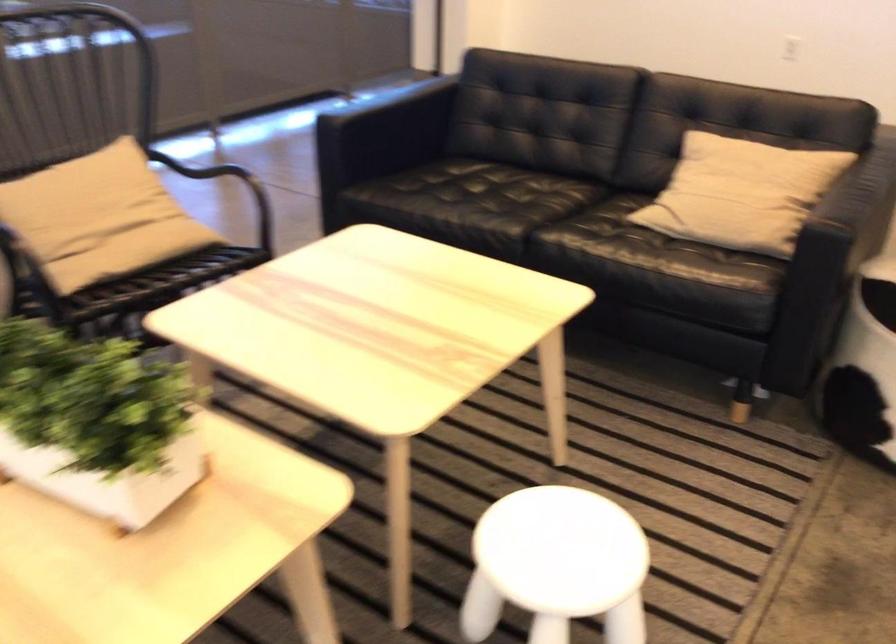
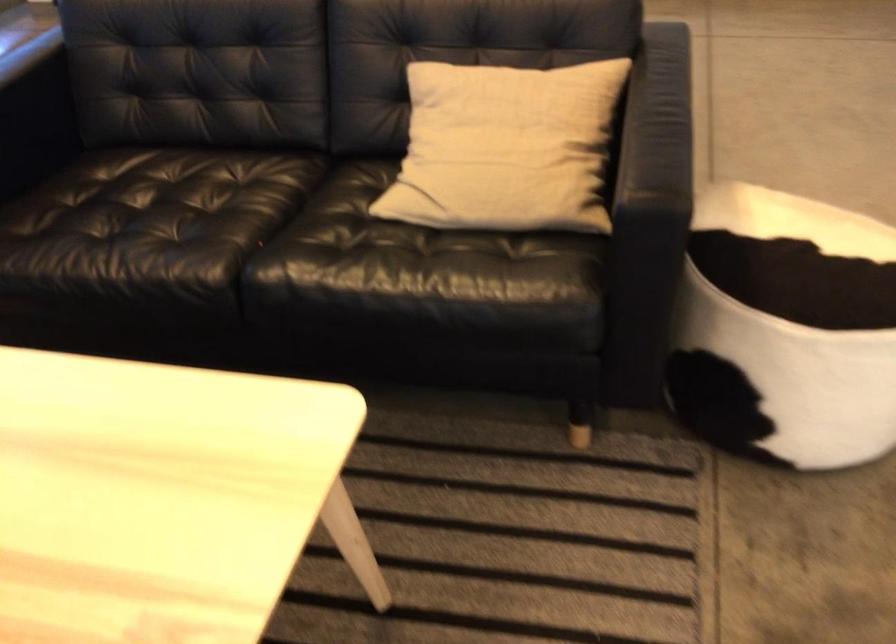
Where in the second image is the point corresponding to (x=739, y=187) from the first image?

(505, 147)